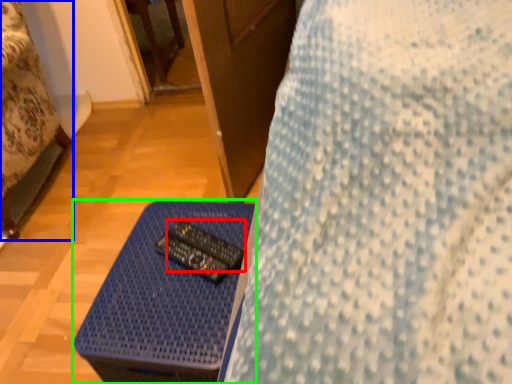
Question: Considering the real-world distances, which object is closest to control (highlighted by a red box)? furniture (highlighted by a blue box) or table (highlighted by a green box).

Choices:
 (A) furniture
 (B) table

Answer: (B)